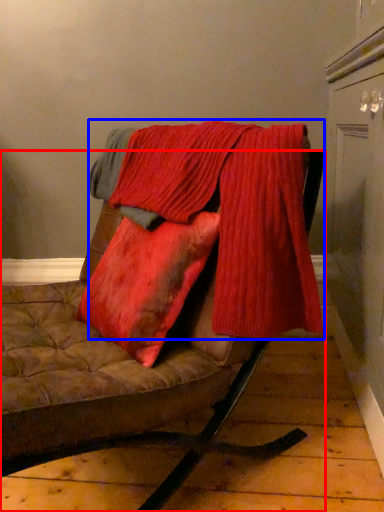
Question: Which object appears farthest to the camera in this image, furniture (highlighted by a red box) or laundry (highlighted by a blue box)?

Choices:
 (A) furniture
 (B) laundry

Answer: (B)